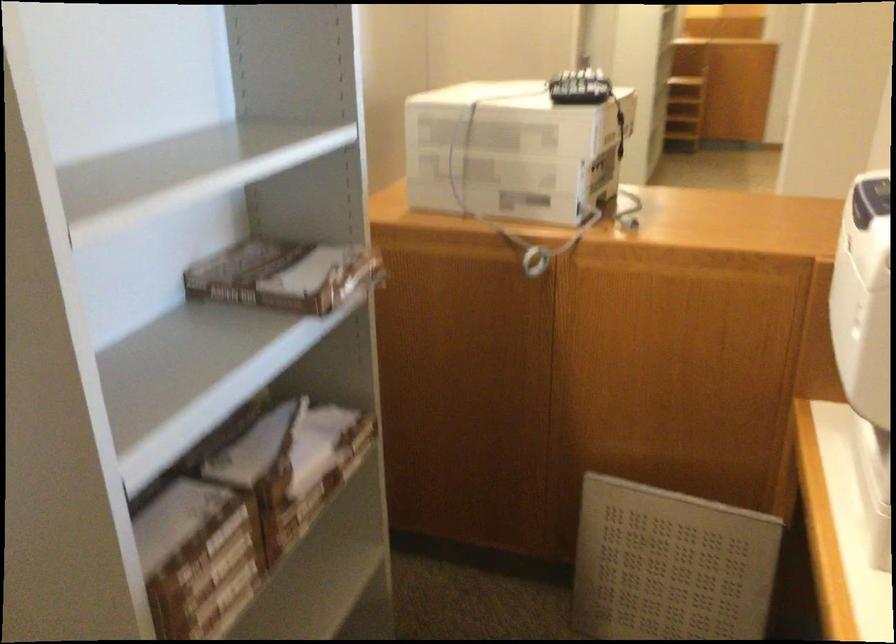
The image size is (896, 644). I want to click on grey perforated panel, so click(669, 565).